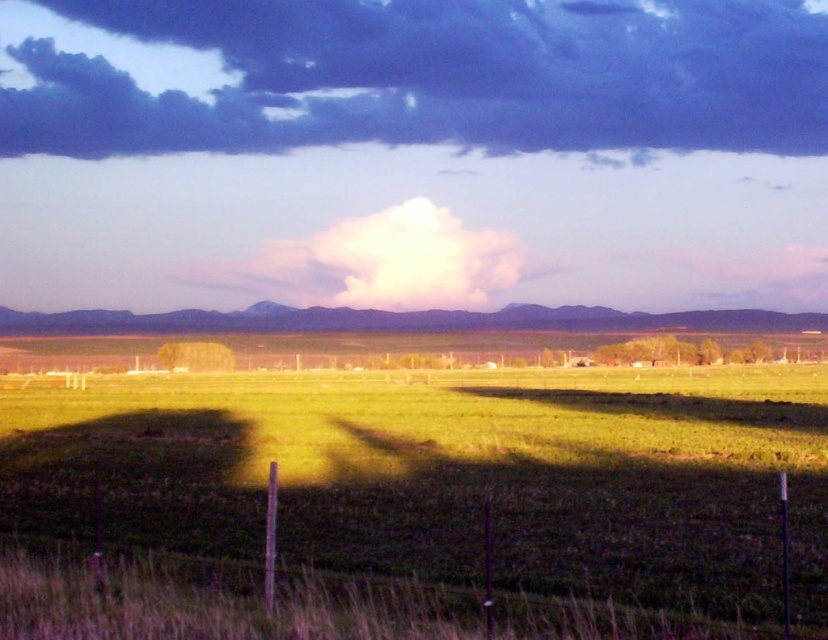
You are standing in the rural landscape and want to take a photo of the green grassy field at center and the dark blue cloud at upper center. Which object is closer to the camera?

The green grassy field at center is closer to the camera than the dark blue cloud at upper center because it is positioned below it.

Based on the scene description, which object takes up more area in the image, the green grassy field at center or the dark blue cloud at upper center?

The dark blue cloud at upper center occupies more space in the image than the green grassy field at center according to the description.

You are standing in the middle of the field in the rural landscape scene. There are two points marked in the image. Which point is closer to you, point (503, 371) or point (812, 147)?

Point (503, 371) is closer to the viewer than point (812, 147).